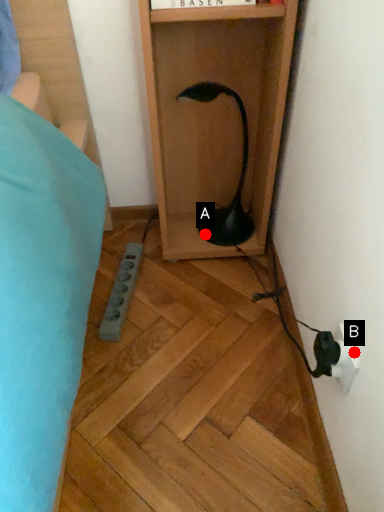
Question: Two points are circled on the image, labeled by A and B beside each circle. Which point appears closest to the camera in this image?

Choices:
 (A) A is closer
 (B) B is closer

Answer: (B)